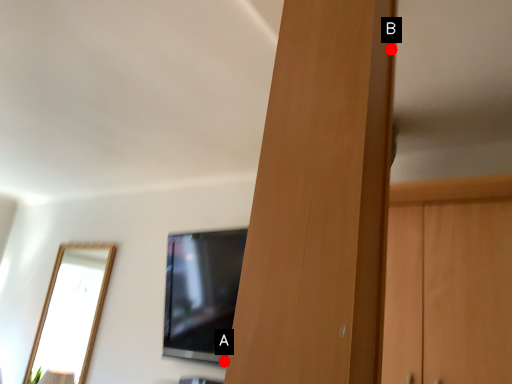
Question: Two points are circled on the image, labeled by A and B beside each circle. Among these points, which one is nearest to the camera?

Choices:
 (A) A is closer
 (B) B is closer

Answer: (B)